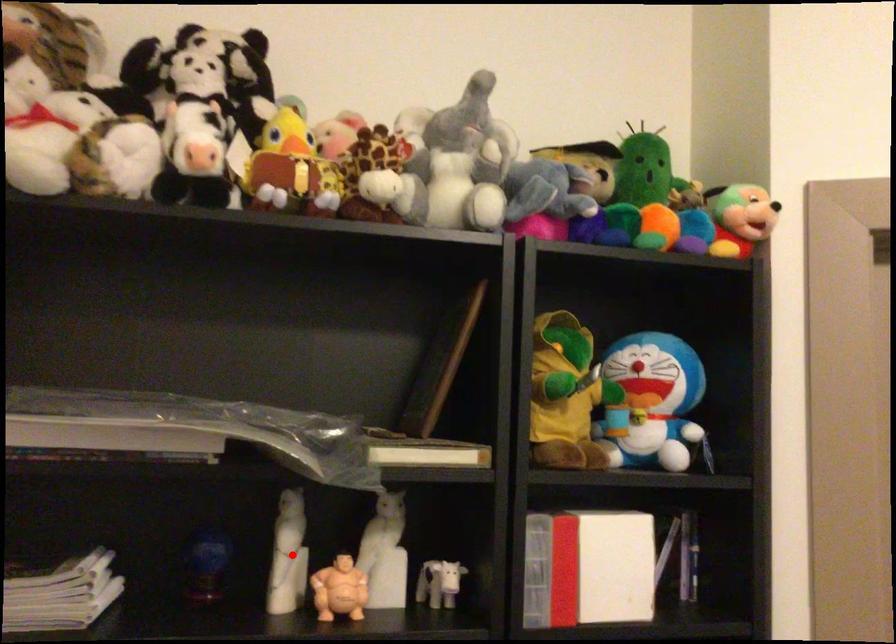
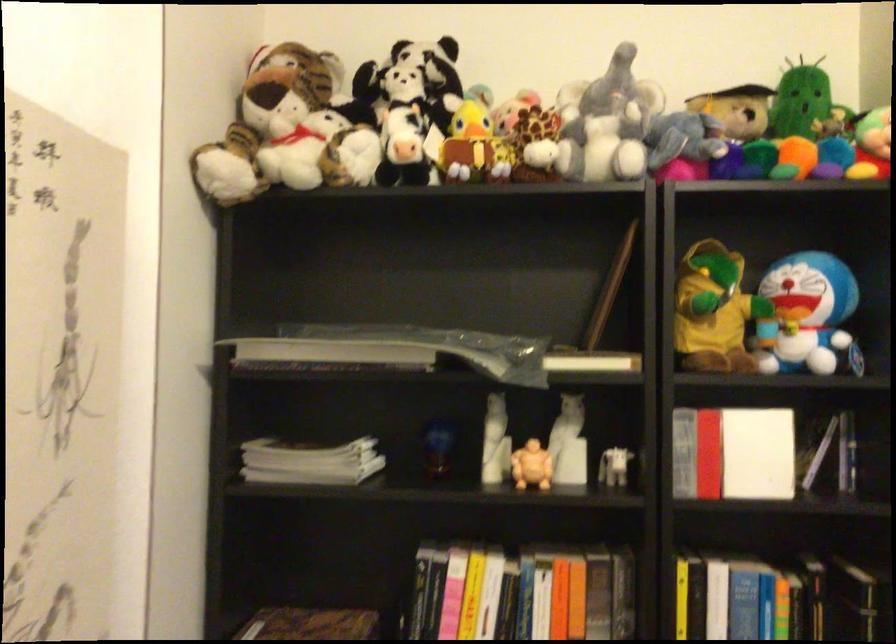
The point at the highlighted location is marked in the first image. Where is the corresponding point in the second image?

(495, 442)